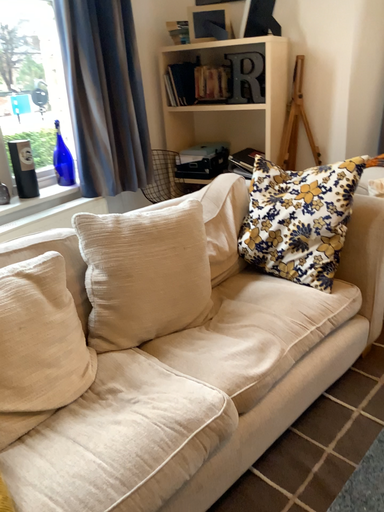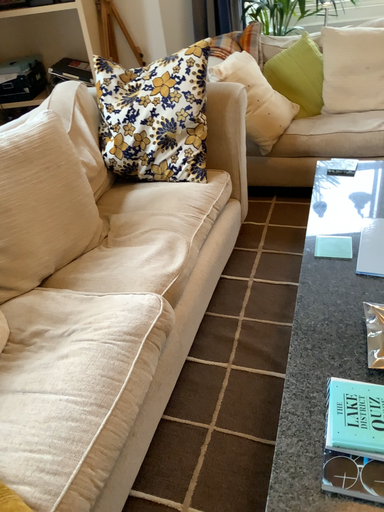
Question: Which way did the camera rotate in the video?

Choices:
 (A) rotated left
 (B) rotated right

Answer: (B)